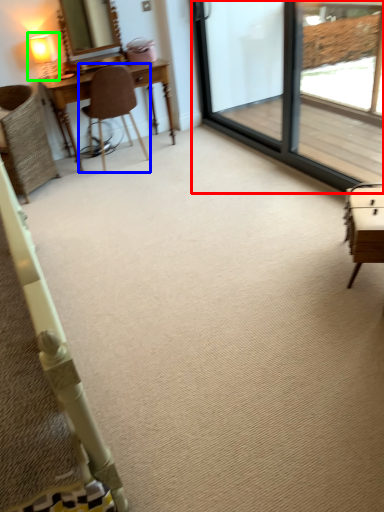
Question: Based on their relative distances, which object is nearer to screen door (highlighted by a red box)? Choose from chair (highlighted by a blue box) and table lamp (highlighted by a green box).

Choices:
 (A) chair
 (B) table lamp

Answer: (A)